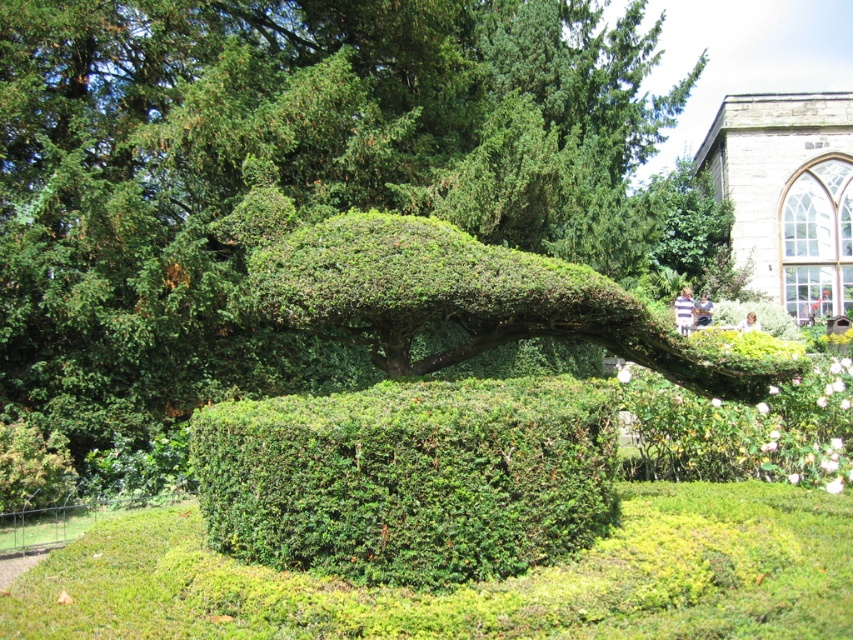
Question: Which point is closer to the camera?

Choices:
 (A) green leafy hedge at center
 (B) green leafy bush at center

Answer: (A)

Question: Does green leafy bush at center appear over green leafy hedge at center?

Choices:
 (A) yes
 (B) no

Answer: (A)

Question: Is green leafy bush at center to the right of green leafy hedge at center from the viewer's perspective?

Choices:
 (A) no
 (B) yes

Answer: (B)

Question: Is green leafy bush at center to the right of green leafy hedge at center from the viewer's perspective?

Choices:
 (A) yes
 (B) no

Answer: (A)